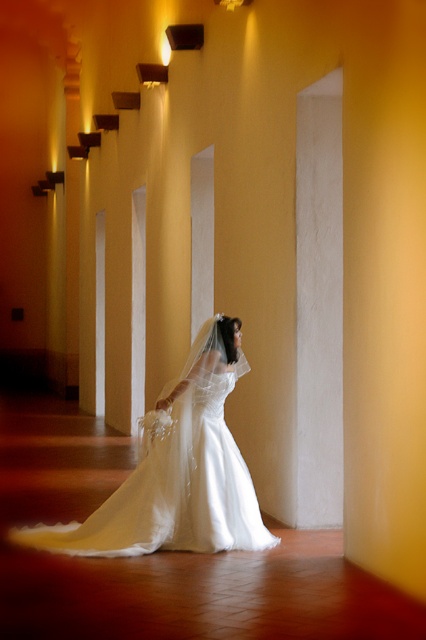
Does white satin dress at center appear on the right side of white marble pillar at center?

In fact, white satin dress at center is to the left of white marble pillar at center.

Identify the location of white satin dress at center. (178, 472).